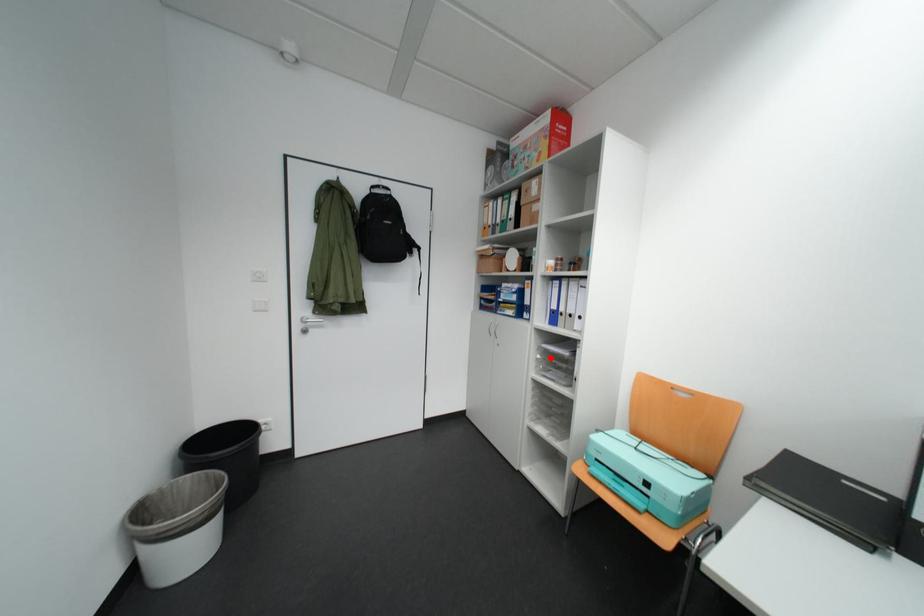
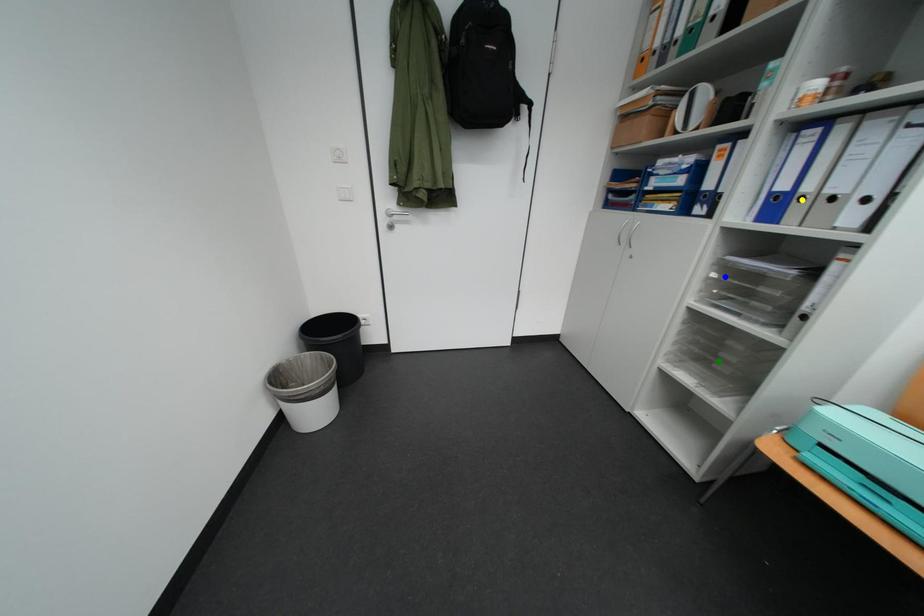
Question: I am providing you with two images of the same scene from different viewpoints. A red point is marked on the first image. You are given multiple points on the second image. Which spot in image 2 lines up with the point in image 1?

Choices:
 (A) blue point
 (B) green point
 (C) yellow point

Answer: (A)